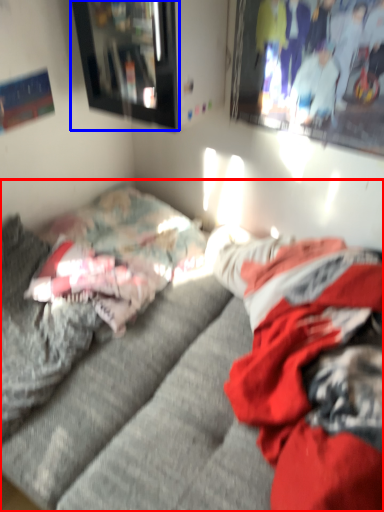
Question: Among these objects, which one is farthest to the camera, studio couch (highlighted by a red box) or picture frame (highlighted by a blue box)?

Choices:
 (A) studio couch
 (B) picture frame

Answer: (B)